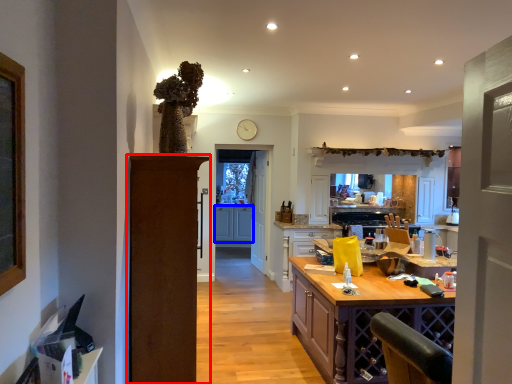
Question: Which point is further to the camera, door (highlighted by a red box) or cabinetry (highlighted by a blue box)?

Choices:
 (A) door
 (B) cabinetry

Answer: (B)